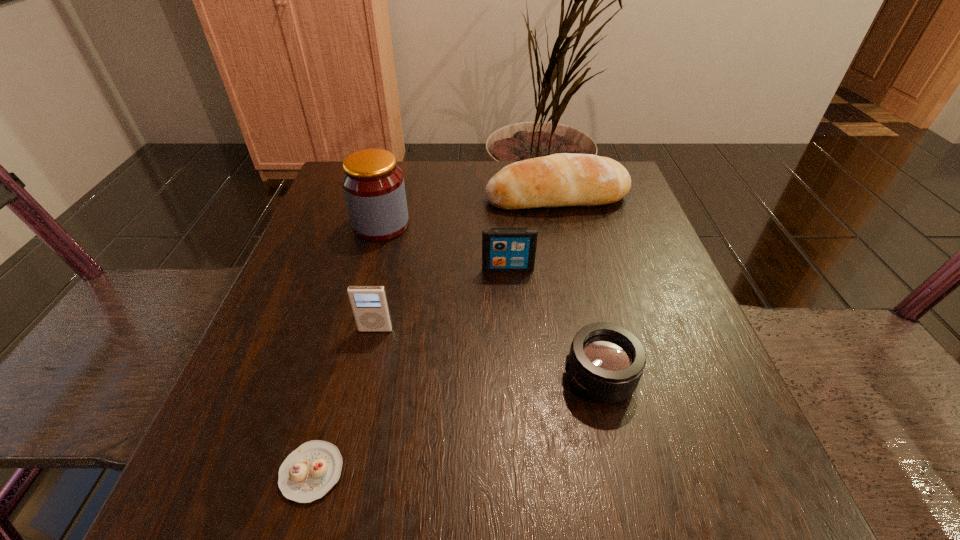
Where is `the tallest object`? This screenshot has width=960, height=540. the tallest object is located at coordinates (373, 184).

Locate an element on the screen. bread is located at coordinates point(564,179).

Find the location of a particular element. The height and width of the screenshot is (540, 960). the fourth farthest object is located at coordinates (369, 304).

The width and height of the screenshot is (960, 540). In order to click on the nearer iPod in this screenshot , I will do click(x=369, y=304).

This screenshot has width=960, height=540. What are the coordinates of `the third farthest object` in the screenshot? It's located at (503, 249).

Locate an element on the screen. This screenshot has width=960, height=540. the right iPod is located at coordinates (503, 249).

This screenshot has height=540, width=960. I want to click on the second shortest object, so click(x=606, y=361).

Where is `telephoto lens`? telephoto lens is located at coordinates (606, 361).

Locate an element on the screen. The image size is (960, 540). cupcake is located at coordinates (309, 472).

Where is `the shortest object`? This screenshot has width=960, height=540. the shortest object is located at coordinates (309, 472).